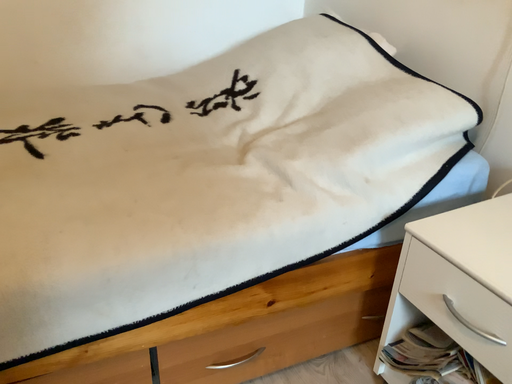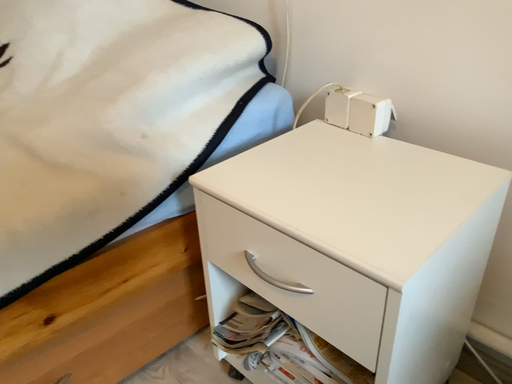
Question: Which way did the camera rotate in the video?

Choices:
 (A) rotated left
 (B) rotated right

Answer: (B)